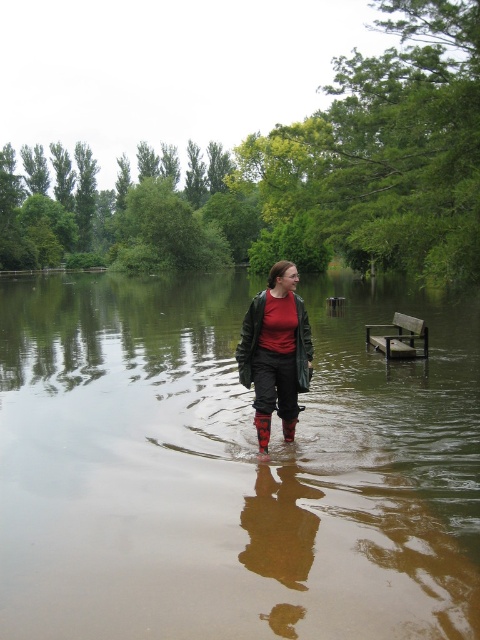
Does wooden bench at lower right appear under rubber matte rain boot at center?

No, wooden bench at lower right is not below rubber matte rain boot at center.

Between point (420, 332) and point (292, 420), which one is positioned behind?

The point (420, 332) is behind.

The image size is (480, 640). I want to click on wooden bench at lower right, so click(x=399, y=337).

Identify the location of wooden bench at lower right. (399, 337).

Measure the distance between point [272,332] and camera.

Point [272,332] is 20.70 feet away from camera.

Which of these two, matte black jacket at center or rubber matte rain boot at center, stands shorter?

rubber matte rain boot at center

Find the location of a particular element. The image size is (480, 640). matte black jacket at center is located at coordinates (276, 349).

Between matte black jacket at center and wooden bench at lower right, which one appears on the right side from the viewer's perspective?

wooden bench at lower right

Does matte black jacket at center have a larger size compared to wooden bench at lower right?

No.

The width and height of the screenshot is (480, 640). What do you see at coordinates (276, 349) in the screenshot? I see `matte black jacket at center` at bounding box center [276, 349].

The image size is (480, 640). I want to click on matte black jacket at center, so click(x=276, y=349).